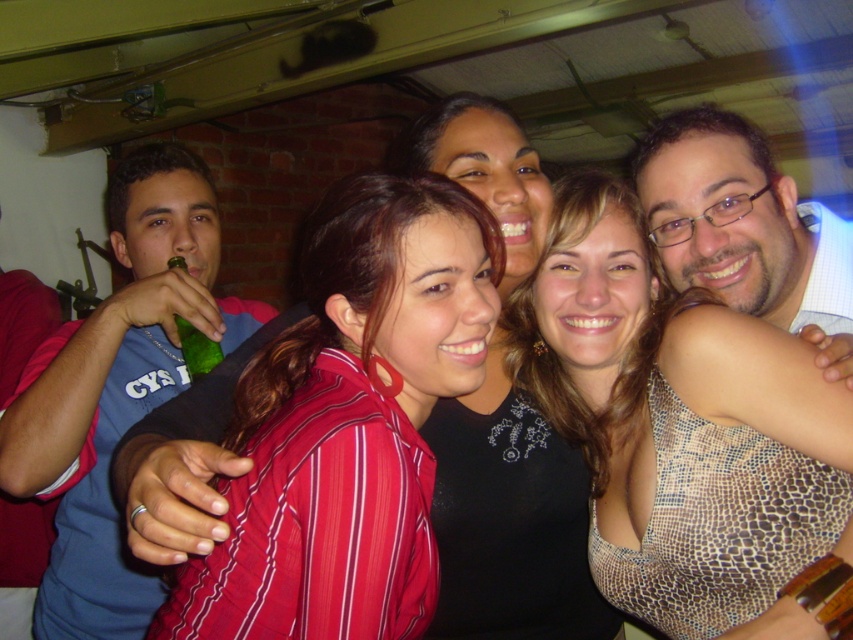
I want to click on striped fabric shirt at center, so click(x=349, y=422).

Does striped fabric shirt at center have a larger size compared to blue fabric shirt at left?

No.

Is point (264, 452) closer to camera compared to point (107, 346)?

Yes, point (264, 452) is closer to viewer.

Find the location of a particular element. The image size is (853, 640). striped fabric shirt at center is located at coordinates (349, 422).

Is point (0, 417) farther from camera compared to point (202, 348)?

No, (0, 417) is in front of (202, 348).

Which is in front, point (212, 300) or point (213, 365)?

Point (213, 365) is in front.

The image size is (853, 640). In order to click on blue fabric shirt at left in this screenshot , I will do `click(117, 388)`.

Consider the image. Is striped fabric shirt at center closer to the viewer compared to red cotton shirt at left?

Yes, striped fabric shirt at center is closer to the viewer.

Is striped fabric shirt at center below red cotton shirt at left?

Yes.

Which is behind, point (315, 387) or point (24, 573)?

The point (24, 573) is more distant.

The height and width of the screenshot is (640, 853). In order to click on striped fabric shirt at center in this screenshot , I will do `click(349, 422)`.